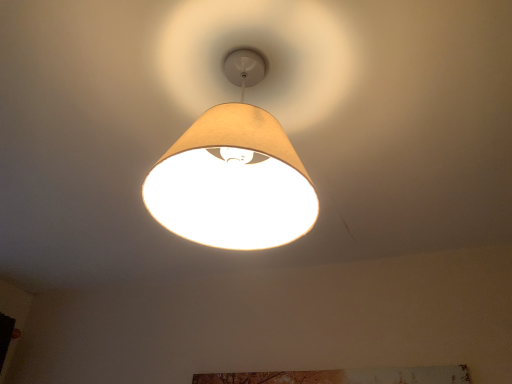
Find the location of a particular element. beige fabric lampshade at center is located at coordinates (233, 175).

Measure the distance between beige fabric lampshade at center and camera.

beige fabric lampshade at center and camera are 23.34 inches apart.

What do you see at coordinates (233, 175) in the screenshot?
I see `beige fabric lampshade at center` at bounding box center [233, 175].

Identify the location of beige fabric lampshade at center. The image size is (512, 384). (233, 175).